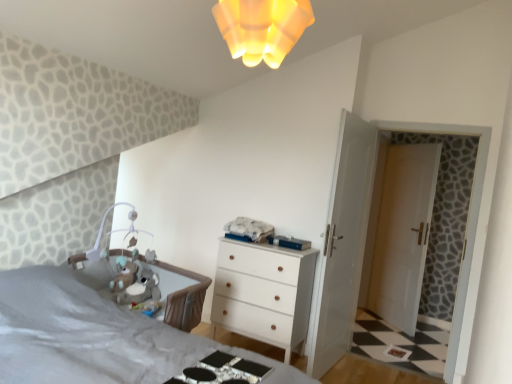
This screenshot has width=512, height=384. Describe the element at coordinates (403, 233) in the screenshot. I see `white glossy door at right, acting as the first door starting from the right` at that location.

What do you see at coordinates (342, 245) in the screenshot? The height and width of the screenshot is (384, 512). I see `white glossy door at center, positioned as the 1th door in left-to-right order` at bounding box center [342, 245].

In order to face white glossy door at center, which ranks as the 2th door in right-to-left order, should I rotate leftwards or rightwards?

Turn right by 11.026 degrees to look at white glossy door at center, which ranks as the 2th door in right-to-left order.

Locate an element on the screen. This screenshot has width=512, height=384. white glossy door at right is located at coordinates click(465, 232).

You are a GUI agent. You are given a task and a screenshot of the screen. Output one action in this format:
    pyautogui.click(x=<x>, y=<y>)
    Task: Click on the metallic silver changing table at lower center
    
    Given the screenshot: What is the action you would take?
    pyautogui.click(x=222, y=371)

Locate an element on the screen. The width and height of the screenshot is (512, 384). white matte chest of drawers at center is located at coordinates (264, 293).

Locate an element on the screen. This screenshot has width=512, height=384. white glossy door at right, which is the 1th door in back-to-front order is located at coordinates click(403, 233).

From their relative heights in the image, would you say white glossy door at center, positioned as the 1th door in left-to-right order, is taller or shorter than metallic silver changing table at lower center?

white glossy door at center, positioned as the 1th door in left-to-right order, is taller than metallic silver changing table at lower center.

Does white glossy door at center, which ranks as the 2th door in right-to-left order, turn towards metallic silver changing table at lower center?

No, white glossy door at center, which ranks as the 2th door in right-to-left order, is not turned towards metallic silver changing table at lower center.

From a real-world perspective, is white glossy door at center, positioned as the 1th door in left-to-right order, above or below metallic silver changing table at lower center?

Clearly, from a real-world perspective, white glossy door at center, positioned as the 1th door in left-to-right order, is above metallic silver changing table at lower center.

From the image's perspective, is white glossy door at center, positioned as the 2th door in back-to-front order, above or below metallic silver changing table at lower center?

From the image's perspective, white glossy door at center, positioned as the 2th door in back-to-front order, appears above metallic silver changing table at lower center.

From the image's perspective, is white glossy door at right, which is the 1th door in back-to-front order, beneath yellow frosted glass light fixture at upper center?

Yes, from the image's perspective, white glossy door at right, which is the 1th door in back-to-front order, is beneath yellow frosted glass light fixture at upper center.

Between white glossy door at right, which is the 1th door in back-to-front order, and yellow frosted glass light fixture at upper center, which one appears on the left side from the viewer's perspective?

yellow frosted glass light fixture at upper center is more to the left.

Considering the points (382, 193) and (285, 9), which point is in front, point (382, 193) or point (285, 9)?

Point (285, 9)

Does white glossy door at right, acting as the first door starting from the right, have a lesser height compared to yellow frosted glass light fixture at upper center?

Incorrect, the height of white glossy door at right, acting as the first door starting from the right, does not fall short of that of yellow frosted glass light fixture at upper center.

Locate an element on the screen. the chest of drawers that is behind the metallic silver changing table at lower center is located at coordinates (264, 293).

Could you tell me if white matte chest of drawers at center is turned towards metallic silver changing table at lower center?

Yes.

From a real-world perspective, which is physically above, white matte chest of drawers at center or metallic silver changing table at lower center?

metallic silver changing table at lower center, from a real-world perspective.

Can you confirm if white matte chest of drawers at center is positioned to the left of metallic silver changing table at lower center?

No.

Can you confirm if white matte chest of drawers at center is positioned to the left of soft plush toy at center?

No.

Which is behind, point (276, 270) or point (137, 298)?

The point (276, 270) is more distant.

From a real-world perspective, which object stands above the other?

soft plush toy at center, from a real-world perspective.

Considering the sizes of objects white matte chest of drawers at center and soft plush toy at center in the image provided, who is thinner, white matte chest of drawers at center or soft plush toy at center?

Thinner between the two is soft plush toy at center.

Which object is thinner, yellow frosted glass light fixture at upper center or white glossy door at center, which ranks as the first door in front-to-back order?

Thinner between the two is white glossy door at center, which ranks as the first door in front-to-back order.

Which door is the 1st one when counting from the right side of the yellow frosted glass light fixture at upper center? Please provide its 2D coordinates.

[(342, 245)]

Between yellow frosted glass light fixture at upper center and white glossy door at center, positioned as the 1th door in left-to-right order, which one has more height?

white glossy door at center, positioned as the 1th door in left-to-right order, is taller.

Could you tell me if yellow frosted glass light fixture at upper center is turned towards white glossy door at center, positioned as the 2th door in back-to-front order?

No, yellow frosted glass light fixture at upper center is not turned towards white glossy door at center, positioned as the 2th door in back-to-front order.

From a real-world perspective, between white matte chest of drawers at center and white glossy door at right, positioned as the 2th door in front-to-back order, who is vertically higher?

In real-world perspective, white glossy door at right, positioned as the 2th door in front-to-back order, is above.

Considering the relative positions of white matte chest of drawers at center and white glossy door at right, positioned as the 2th door in front-to-back order, in the image provided, is white matte chest of drawers at center to the left of white glossy door at right, positioned as the 2th door in front-to-back order, from the viewer's perspective?

Yes, white matte chest of drawers at center is to the left of white glossy door at right, positioned as the 2th door in front-to-back order.

Is white matte chest of drawers at center not close to white glossy door at right, acting as the first door starting from the right?

white matte chest of drawers at center is positioned a significant distance from white glossy door at right, acting as the first door starting from the right.

Which is more to the right, white glossy door at center, which ranks as the 2th door in right-to-left order, or white glossy door at right?

white glossy door at right.

How many degrees apart are the facing directions of white glossy door at center, positioned as the 2th door in back-to-front order, and white glossy door at right?

The angular difference between white glossy door at center, positioned as the 2th door in back-to-front order, and white glossy door at right is 80.7 degrees.

There is a white glossy door at right. Where is `the 2nd door below it (from a real-world perspective)`? the 2nd door below it (from a real-world perspective) is located at coordinates (342, 245).

Where is `changing table below the white glossy door at center, which ranks as the first door in front-to-back order (from a real-world perspective)`? Image resolution: width=512 pixels, height=384 pixels. changing table below the white glossy door at center, which ranks as the first door in front-to-back order (from a real-world perspective) is located at coordinates (222, 371).

At what (x,y) coordinates should I click in order to perform the action: click on light fixture lying above the white glossy door at right, positioned as the 2th door in front-to-back order (from the image's perspective). Please return your answer as a coordinate pair (x, y). Looking at the image, I should click on (262, 28).

Considering their positions, is white glossy door at right positioned closer to white glossy door at right, placed as the 2th door when sorted from left to right, than metallic silver changing table at lower center?

white glossy door at right is positioned closer to the anchor white glossy door at right, placed as the 2th door when sorted from left to right.

Which object lies further to the anchor point yellow frosted glass light fixture at upper center, soft plush toy at center or white glossy door at right?

Based on the image, white glossy door at right appears to be further to yellow frosted glass light fixture at upper center.

From the image, which object appears to be farther from white glossy door at center, positioned as the 2th door in back-to-front order, metallic silver changing table at lower center or white glossy door at right, placed as the 2th door when sorted from left to right?

white glossy door at right, placed as the 2th door when sorted from left to right, is positioned further to the anchor white glossy door at center, positioned as the 2th door in back-to-front order.

Looking at this image, when comparing their distances from white glossy door at right, positioned as the 2th door in front-to-back order, does white glossy door at right or white matte chest of drawers at center seem closer?

white glossy door at right lies closer to white glossy door at right, positioned as the 2th door in front-to-back order, than the other object.

Consider the image. Based on their spatial positions, is white glossy door at right or white matte chest of drawers at center closer to metallic silver changing table at lower center?

white matte chest of drawers at center.

Looking at the image, which one is located closer to soft plush toy at center, white matte chest of drawers at center or yellow frosted glass light fixture at upper center?

white matte chest of drawers at center.

Which object lies further to the anchor point yellow frosted glass light fixture at upper center, soft plush toy at center or white glossy door at right, which is the 1th door in back-to-front order?

white glossy door at right, which is the 1th door in back-to-front order, is positioned further to the anchor yellow frosted glass light fixture at upper center.

Considering their positions, is metallic silver changing table at lower center positioned further to white glossy door at center, which ranks as the 2th door in right-to-left order, than soft gray fabric infant bed at lower left?

metallic silver changing table at lower center is further to white glossy door at center, which ranks as the 2th door in right-to-left order.

I want to click on chest of drawers between soft plush toy at center and white glossy door at right, positioned as the 2th door in front-to-back order, so click(264, 293).

This screenshot has width=512, height=384. Identify the location of infant bed between metallic silver changing table at lower center and white glossy door at right, positioned as the 2th door in front-to-back order, in the front-back direction. (183, 296).

What are the coordinates of `infant bed located between soft plush toy at center and white glossy door at center, which ranks as the 2th door in right-to-left order, in the left-right direction` in the screenshot? It's located at (183, 296).

Locate an element on the screen. This screenshot has height=384, width=512. animal between yellow frosted glass light fixture at upper center and soft gray fabric infant bed at lower left from top to bottom is located at coordinates (141, 289).